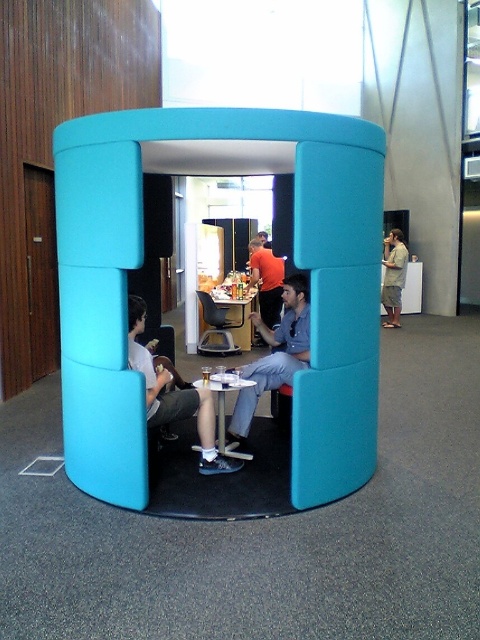
Which is in front, point (254, 362) or point (268, 314)?

Point (254, 362)

Measure the distance between denim shirt at center and orange shirt at center.

denim shirt at center is 8.60 feet away from orange shirt at center.

At what (x,y) coordinates should I click in order to perform the action: click on denim shirt at center. Please return your answer as a coordinate pair (x, y). This screenshot has width=480, height=640. Looking at the image, I should click on (275, 355).

Does orange shirt at center come in front of metallic silver table at center?

Yes, it is in front of metallic silver table at center.

Which of these two, orange shirt at center or metallic silver table at center, stands taller?

Standing taller between the two is orange shirt at center.

Is point (277, 285) positioned in front of point (231, 323)?

Yes, point (277, 285) is in front of point (231, 323).

Identify the location of orange shirt at center. (266, 280).

Can you confirm if matte gray pants at center is wider than light brown shorts at right?

Correct, the width of matte gray pants at center exceeds that of light brown shorts at right.

Consider the image. Who is shorter, matte gray pants at center or light brown shorts at right?

Standing shorter between the two is matte gray pants at center.

Find the location of a particular element. The width and height of the screenshot is (480, 640). matte gray pants at center is located at coordinates (173, 396).